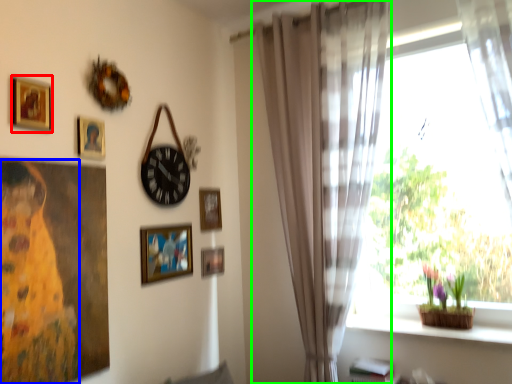
Question: Which object is positioned closest to picture frame (highlighted by a red box)? Select from woman (highlighted by a blue box) and curtain (highlighted by a green box).

Choices:
 (A) woman
 (B) curtain

Answer: (A)